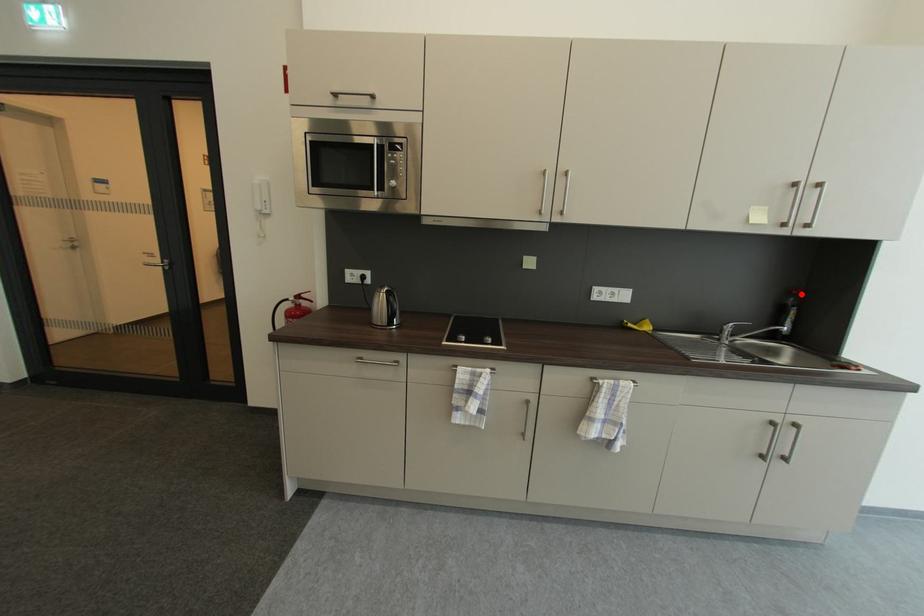
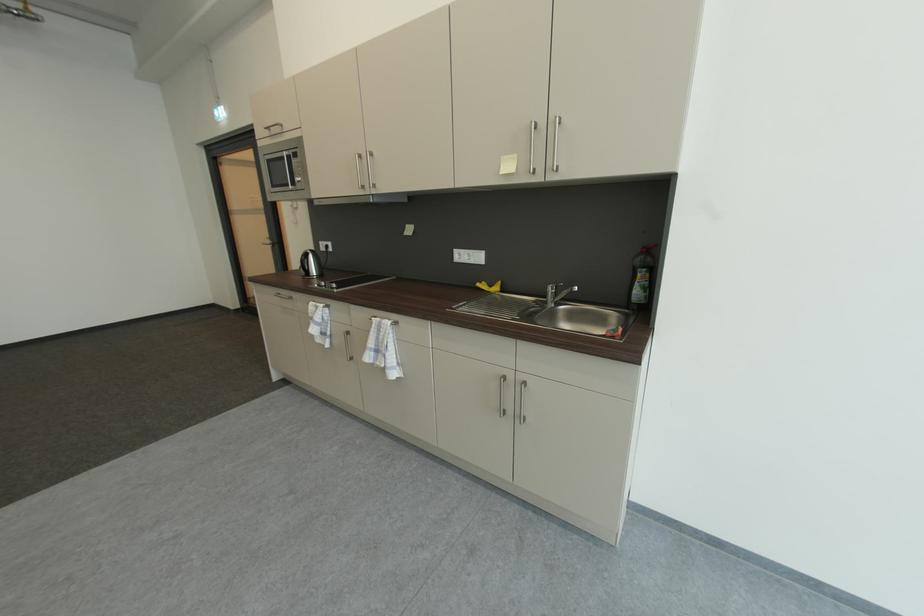
The point at the highlighted location is marked in the first image. Where is the corresponding point in the second image?

(650, 252)